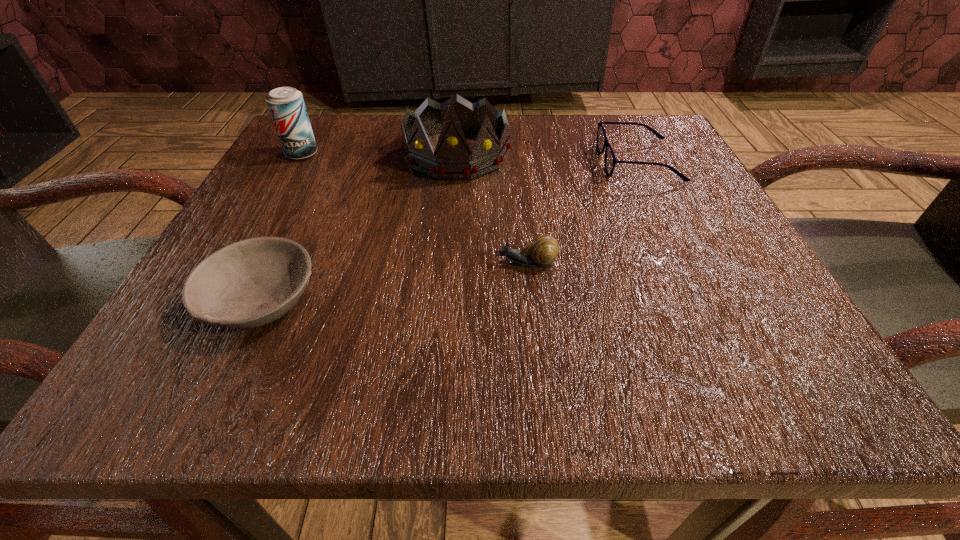
The image size is (960, 540). In the image, there is a desktop. Find the location of `vacant space at the far right corner`. vacant space at the far right corner is located at coordinates (613, 126).

Locate an element on the screen. The height and width of the screenshot is (540, 960). empty location between the spectacles and the bowl is located at coordinates (449, 231).

I want to click on vacant point located between the tallest object and the second tallest object, so click(379, 154).

In order to click on empty location between the bowl and the spectacles in this screenshot , I will do `click(449, 231)`.

Image resolution: width=960 pixels, height=540 pixels. Identify the location of vacant point located between the rightmost object and the tiara. tap(547, 158).

Identify the location of free area in between the bowl and the tiara. Image resolution: width=960 pixels, height=540 pixels. (358, 227).

You are a GUI agent. You are given a task and a screenshot of the screen. Output one action in this format:
    pyautogui.click(x=<x>, y=<y>)
    Task: Click on the vacant area that lies between the escargot and the rightmost object
    This screenshot has width=960, height=540.
    Given the screenshot: What is the action you would take?
    pyautogui.click(x=582, y=213)

The width and height of the screenshot is (960, 540). What are the coordinates of `blank region between the spectacles and the escargot` in the screenshot? It's located at (582, 213).

You are a GUI agent. You are given a task and a screenshot of the screen. Output one action in this format:
    pyautogui.click(x=<x>, y=<y>)
    Task: Click on the empty space between the bowl and the escargot
    
    Given the screenshot: What is the action you would take?
    pyautogui.click(x=393, y=281)

You are a GUI agent. You are given a task and a screenshot of the screen. Output one action in this format:
    pyautogui.click(x=<x>, y=<y>)
    Task: Click on the blank region between the bowl and the beer can
    
    Given the screenshot: What is the action you would take?
    pyautogui.click(x=281, y=227)